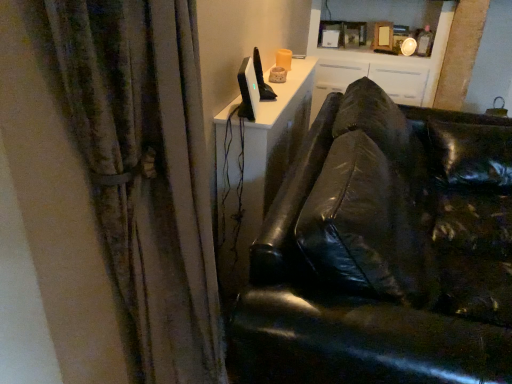
What do you see at coordinates (145, 169) in the screenshot?
I see `textured fabric curtain at left` at bounding box center [145, 169].

What is the approximate width of white glossy cabinet at upper center?

It is 19.04 inches.

Identify the location of textured fabric curtain at left. The height and width of the screenshot is (384, 512). (145, 169).

Choose the correct answer: Is satin black monitor at upper center inside black leather couch at right or outside it?

satin black monitor at upper center exists outside the volume of black leather couch at right.

Does point (254, 98) appear closer or farther from the camera than point (312, 308)?

Point (254, 98) is farther from the camera than point (312, 308).

Which object is thinner, satin black monitor at upper center or black leather couch at right?

satin black monitor at upper center.

Can you confirm if textured fabric curtain at left is positioned to the left of black leather couch at right?

Yes, textured fabric curtain at left is to the left of black leather couch at right.

Considering the sizes of textured fabric curtain at left and black leather couch at right in the image, is textured fabric curtain at left wider or thinner than black leather couch at right?

Clearly, textured fabric curtain at left has less width compared to black leather couch at right.

Is textured fabric curtain at left bigger or smaller than black leather couch at right?

Considering their sizes, textured fabric curtain at left takes up less space than black leather couch at right.

What's the angular difference between textured fabric curtain at left and black leather couch at right's facing directions?

There is a 0.586-degree angle between the facing directions of textured fabric curtain at left and black leather couch at right.

Between black leather couch at right and textured fabric curtain at left, which one appears on the left side from the viewer's perspective?

From the viewer's perspective, textured fabric curtain at left appears more on the left side.

From the image's perspective, would you say black leather couch at right is positioned over textured fabric curtain at left?

Correct, black leather couch at right appears higher than textured fabric curtain at left in the image.

Is black leather couch at right in contact with textured fabric curtain at left?

black leather couch at right and textured fabric curtain at left are clearly separated.

Does point (452, 183) appear closer or farther from the camera than point (134, 119)?

Point (452, 183) appears to be farther away from the viewer than point (134, 119).

Is white glossy cabinet at upper center at the back of satin black monitor at upper center?

No, satin black monitor at upper center is not facing away from white glossy cabinet at upper center.

At what (x,y) coordinates should I click in order to perform the action: click on computer monitor in front of the white glossy cabinet at upper center. Please return your answer as a coordinate pair (x, y). This screenshot has height=384, width=512. Looking at the image, I should click on (248, 89).

Relative to white glossy cabinet at upper center, is satin black monitor at upper center in front or behind?

satin black monitor at upper center is in front of white glossy cabinet at upper center.

Considering the positions of point (245, 107) and point (407, 88), is point (245, 107) closer or farther from the camera than point (407, 88)?

Point (245, 107) is closer to the camera than point (407, 88).

Does white glossy cabinet at upper center appear on the left side of black leather couch at right?

No.

Is white glossy cabinet at upper center oriented towards black leather couch at right?

Yes, white glossy cabinet at upper center is turned towards black leather couch at right.

Considering the relative positions of white glossy cabinet at upper center and black leather couch at right in the image provided, is white glossy cabinet at upper center behind black leather couch at right?

Yes, white glossy cabinet at upper center is further from the camera.

Consider the image. Considering the sizes of objects white glossy cabinet at upper center and black leather couch at right in the image provided, who is smaller, white glossy cabinet at upper center or black leather couch at right?

white glossy cabinet at upper center.

Based on their positions, is textured fabric curtain at left located to the left or right of satin black monitor at upper center?

textured fabric curtain at left is positioned on satin black monitor at upper center's left side.

Locate an element on the screen. curtain on the left of satin black monitor at upper center is located at coordinates (145, 169).

Which point is more forward, (183, 332) or (247, 87)?

The point (183, 332) is more forward.

Is textured fabric curtain at left directly adjacent to satin black monitor at upper center?

No, textured fabric curtain at left is not making contact with satin black monitor at upper center.

Who is bigger, white glossy cabinet at upper center or satin black monitor at upper center?

white glossy cabinet at upper center.

From a real-world perspective, is white glossy cabinet at upper center positioned above or below satin black monitor at upper center?

From a real-world perspective, white glossy cabinet at upper center is physically below satin black monitor at upper center.

Between white glossy cabinet at upper center and satin black monitor at upper center, which one has smaller width?

Thinner between the two is satin black monitor at upper center.

Would you consider white glossy cabinet at upper center to be distant from satin black monitor at upper center?

Yes, white glossy cabinet at upper center and satin black monitor at upper center are quite far apart.

This screenshot has width=512, height=384. In order to click on studio couch in front of the satin black monitor at upper center in this screenshot , I will do `click(384, 252)`.

Identify the location of studio couch located above the textured fabric curtain at left (from the image's perspective). (384, 252).

Looking at this image, considering their positions, is satin black monitor at upper center positioned further to black leather couch at right than textured fabric curtain at left?

satin black monitor at upper center.

Looking at the image, which one is located closer to white glossy cabinet at upper center, textured fabric curtain at left or satin black monitor at upper center?

satin black monitor at upper center is positioned closer to the anchor white glossy cabinet at upper center.

From the image, which object appears to be farther from white glossy cabinet at upper center, black leather couch at right or textured fabric curtain at left?

The object further to white glossy cabinet at upper center is textured fabric curtain at left.

Looking at the image, which one is located further to textured fabric curtain at left, black leather couch at right or satin black monitor at upper center?

Answer: The object further to textured fabric curtain at left is satin black monitor at upper center.

Based on the photo, estimate the real-world distances between objects in this image. Which object is closer to black leather couch at right, white glossy cabinet at upper center or satin black monitor at upper center?

satin black monitor at upper center is positioned closer to the anchor black leather couch at right.

Based on their spatial positions, is white glossy cabinet at upper center or black leather couch at right closer to textured fabric curtain at left?

black leather couch at right lies closer to textured fabric curtain at left than the other object.

Looking at the image, which one is located further to white glossy cabinet at upper center, textured fabric curtain at left or black leather couch at right?

textured fabric curtain at left is positioned further to the anchor white glossy cabinet at upper center.

Estimate the real-world distances between objects in this image. Which object is further from satin black monitor at upper center, black leather couch at right or textured fabric curtain at left?

textured fabric curtain at left.

Find the location of `computer monitor located between black leather couch at right and white glossy cabinet at upper center in the depth direction`. computer monitor located between black leather couch at right and white glossy cabinet at upper center in the depth direction is located at coordinates (248, 89).

I want to click on computer monitor between textured fabric curtain at left and white glossy cabinet at upper center along the z-axis, so click(248, 89).

Locate an element on the screen. This screenshot has width=512, height=384. studio couch positioned between textured fabric curtain at left and satin black monitor at upper center from near to far is located at coordinates (384, 252).

Identify the location of studio couch positioned between textured fabric curtain at left and white glossy cabinet at upper center from near to far. This screenshot has width=512, height=384. (x=384, y=252).